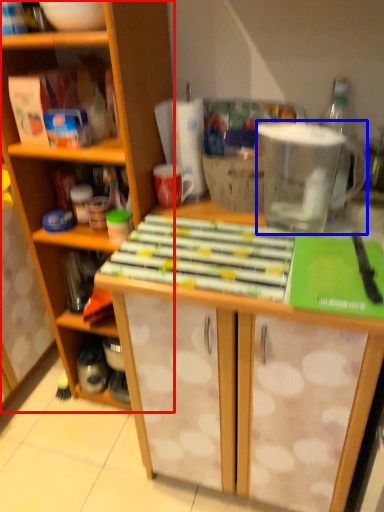
Question: Which object appears closest to the camera in this image, cabinetry (highlighted by a red box) or appliance (highlighted by a blue box)?

Choices:
 (A) cabinetry
 (B) appliance

Answer: (A)